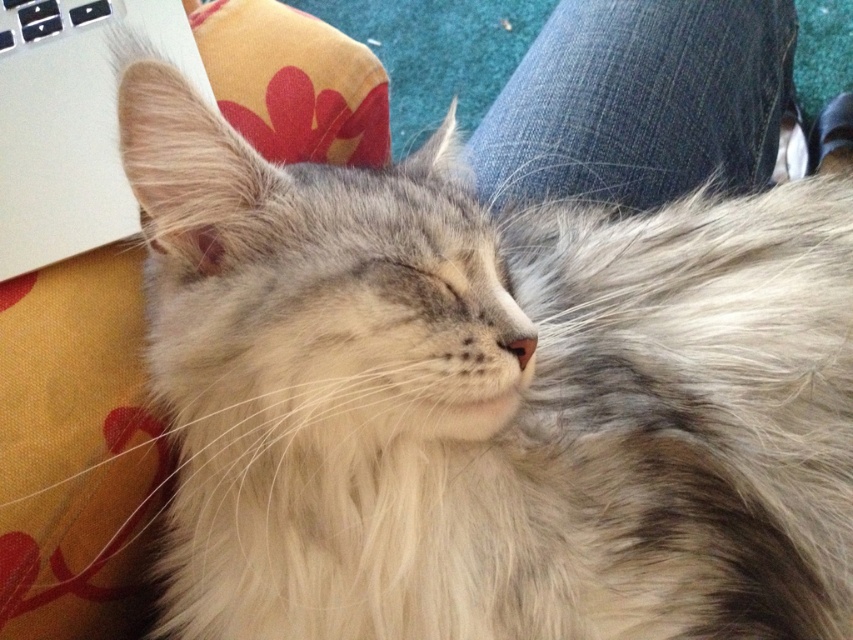
In order to click on denim at center in this screenshot , I will do `click(641, 100)`.

In the scene shown: Is denim at center above silver metallic laptop at upper left?

Yes.

Is point (727, 58) less distant than point (45, 26)?

No, it is behind (45, 26).

The image size is (853, 640). Find the location of `denim at center`. denim at center is located at coordinates (641, 100).

Who is higher up, denim at center or white plastic keyboard at upper left?

Positioned higher is white plastic keyboard at upper left.

Can you confirm if denim at center is thinner than white plastic keyboard at upper left?

No.

What do you see at coordinates (641, 100) in the screenshot? I see `denim at center` at bounding box center [641, 100].

Where is `denim at center`? This screenshot has width=853, height=640. denim at center is located at coordinates (641, 100).

Is silver metallic laptop at upper left to the right of white plastic keyboard at upper left from the viewer's perspective?

Yes, silver metallic laptop at upper left is to the right of white plastic keyboard at upper left.

From the picture: Which is more to the left, silver metallic laptop at upper left or white plastic keyboard at upper left?

From the viewer's perspective, white plastic keyboard at upper left appears more on the left side.

This screenshot has height=640, width=853. Identify the location of silver metallic laptop at upper left. (70, 122).